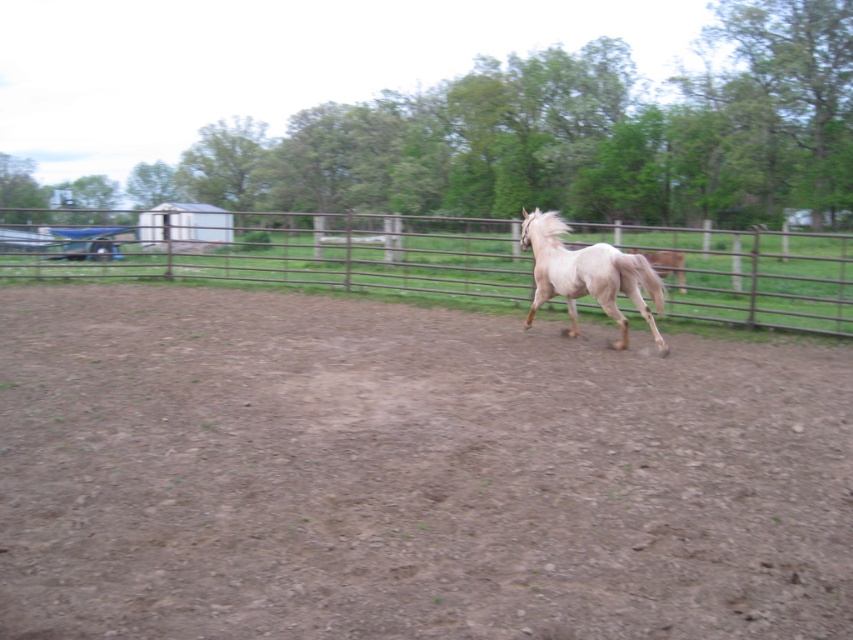
You are standing at the center of the image. Which direction should you walk to reach the rusty metal fence at center?

Since the rusty metal fence at center is located at point coordinates of [289,252], you are already at the center of the image, so you are already at the location of the rusty metal fence at center.

You are a photographer trying to capture the pale beige horse at center from above. Can you position yourself above the brown dirt field at center to get a clear shot of the horse?

The brown dirt field at center is below the pale beige horse at center, so positioning yourself above the field would allow you to capture the horse from above for a clear shot.